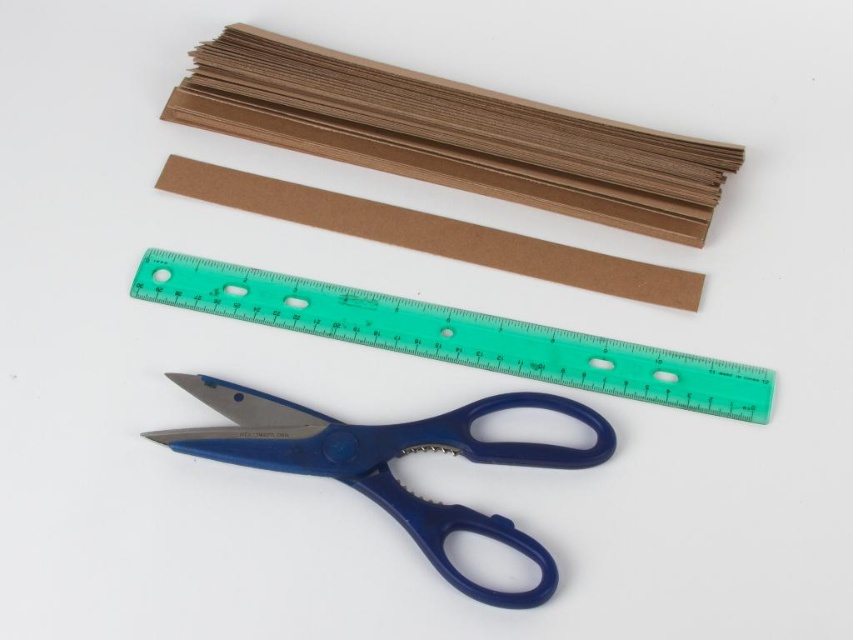
Locate an element on the screen. The image size is (853, 640). brown corrugated cardboard at upper center is located at coordinates (451, 134).

The image size is (853, 640). I want to click on brown corrugated cardboard at upper center, so click(451, 134).

Is the position of green plastic ruler at center more distant than that of blue plastic scissors at lower center?

Yes, green plastic ruler at center is further from the viewer.

Can you confirm if green plastic ruler at center is positioned above blue plastic scissors at lower center?

Yes, green plastic ruler at center is above blue plastic scissors at lower center.

Which is in front, point (631, 365) or point (473, 515)?

Point (473, 515) is more forward.

Find the location of `green plastic ruler at center`. green plastic ruler at center is located at coordinates (456, 336).

Does brown corrugated cardboard at upper center have a greater width compared to blue plastic scissors at lower center?

Yes, brown corrugated cardboard at upper center is wider than blue plastic scissors at lower center.

Describe the element at coordinates (451, 134) in the screenshot. This screenshot has height=640, width=853. I see `brown corrugated cardboard at upper center` at that location.

Who is more distant from viewer, (202, 58) or (346, 445)?

The point (202, 58) is more distant.

Locate an element on the screen. The image size is (853, 640). brown corrugated cardboard at upper center is located at coordinates (x=451, y=134).